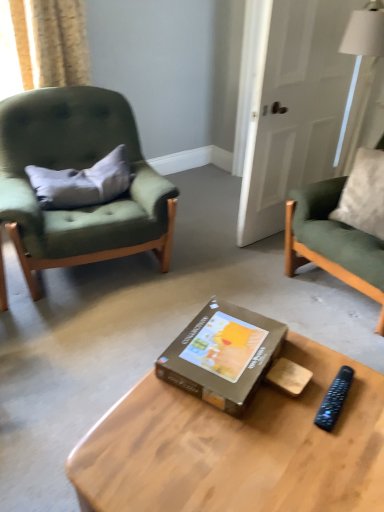
In order to click on vacant space to the right of black plastic remote at lower right in this screenshot , I will do `click(370, 395)`.